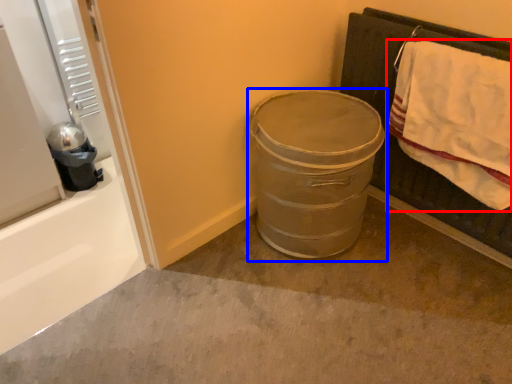
Question: Among these objects, which one is farthest to the camera, bath towel (highlighted by a red box) or trash bin/can (highlighted by a blue box)?

Choices:
 (A) bath towel
 (B) trash bin/can

Answer: (B)